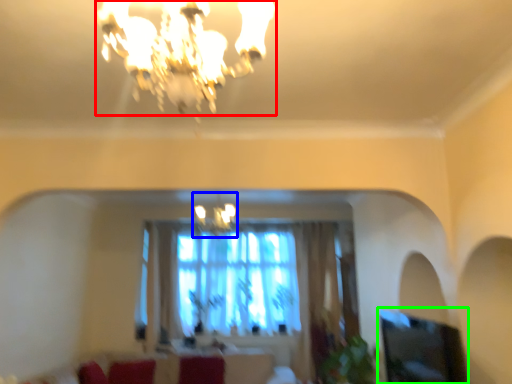
Question: Estimate the real-world distances between objects in this image. Which object is farther from lamp (highlighted by a red box), lamp (highlighted by a blue box) or window screen (highlighted by a green box)?

Choices:
 (A) lamp
 (B) window screen

Answer: (A)